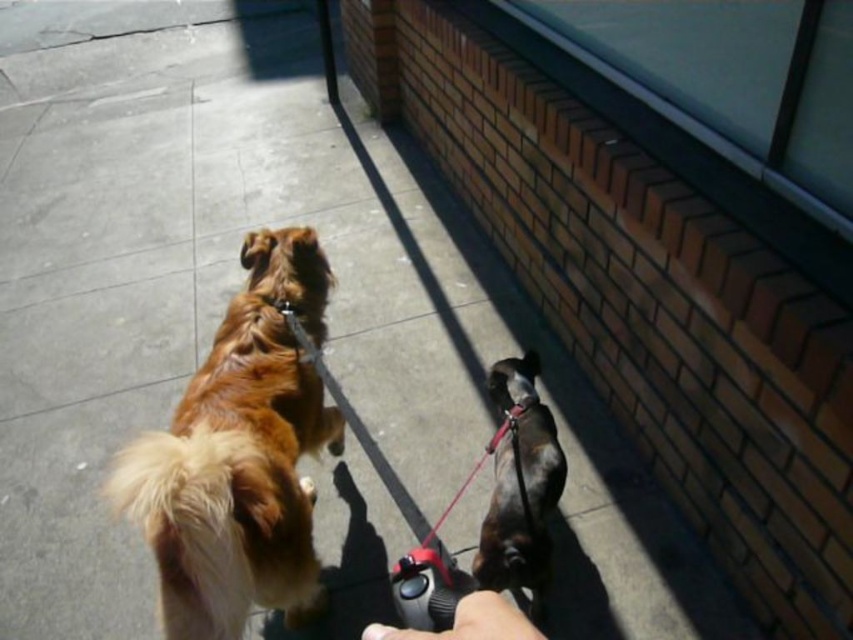
You are holding a leash connected to a dog. There is a point at coordinate point (469, 621). Is this point located on the smooth leather leash at lower center?

Yes, the point (469, 621) is on the smooth leather leash at lower center.

You are holding a smooth leather leash at lower center while walking your dog. You want to know if you can comfortably reach your phone in your pocket without letting go of the leash. The phone is 12 inches away from the leash. Can you reach it?

The distance between the smooth leather leash at lower center and the camera is 15.10 inches. Since your phone is only 12 inches away from the leash, you can comfortably reach it without letting go of the leash.

You are holding a leash connected to a dog. You see two points in the scene, point (294, 406) and point (474, 467). Which point is closer to you?

Point (294, 406) is closer to the camera than point (474, 467).